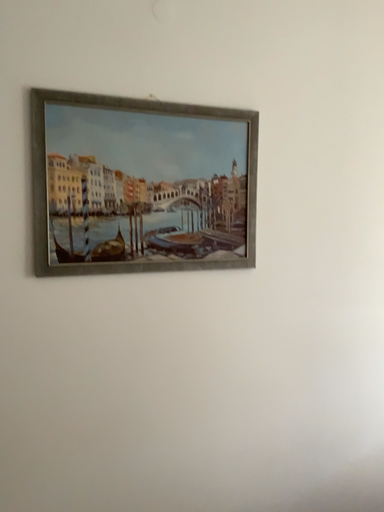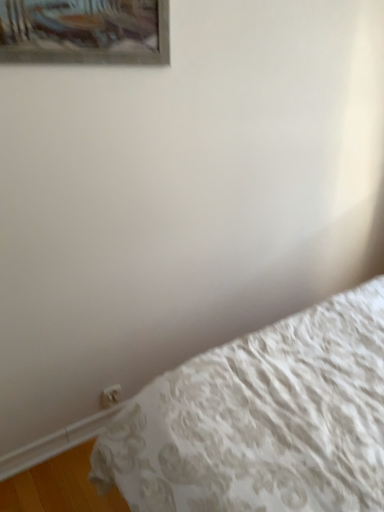
Question: Which way did the camera rotate in the video?

Choices:
 (A) rotated right
 (B) rotated left

Answer: (A)